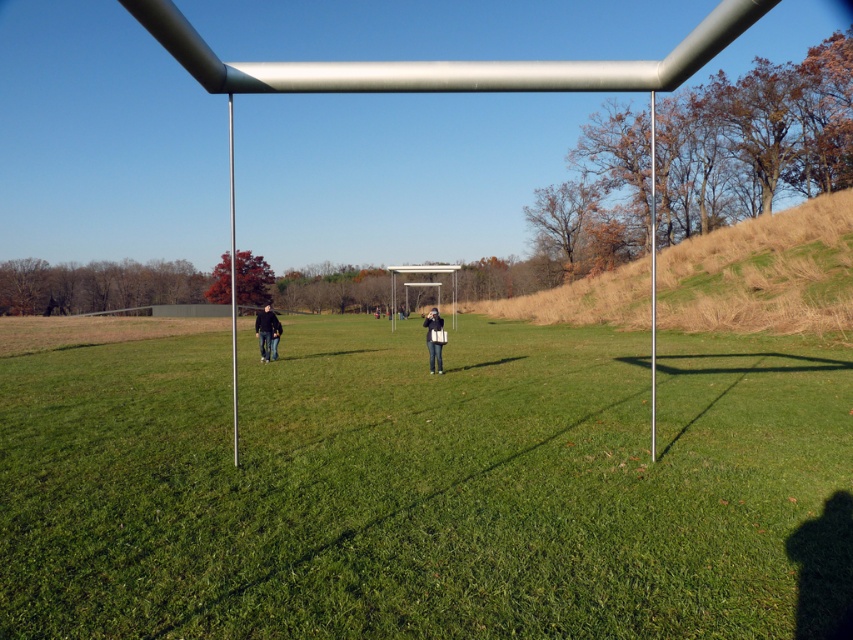
Based on the photo, you are standing in the scene and want to know if the green grassy field at center is shorter than the denim jeans at center. Can you confirm this?

The green grassy field at center is shorter than denim jeans at center, so yes, the grass is shorter than the jeans.

You are standing in the outdoor scene and want to take a photo of the green grassy field at center without any obstructions. Since the dark blue jeans at left are in the way, can you move to the right side to get a clear view?

The green grassy field at center is positioned under the dark blue jeans at left, meaning the jeans are blocking the view. Moving to the right side might allow you to see the green grassy field at center without obstruction from the dark blue jeans at left.

What is the 2D coordinate of the green grassy field at center in the image?

The green grassy field at center is located at the 2D coordinate point of (x=427, y=486).